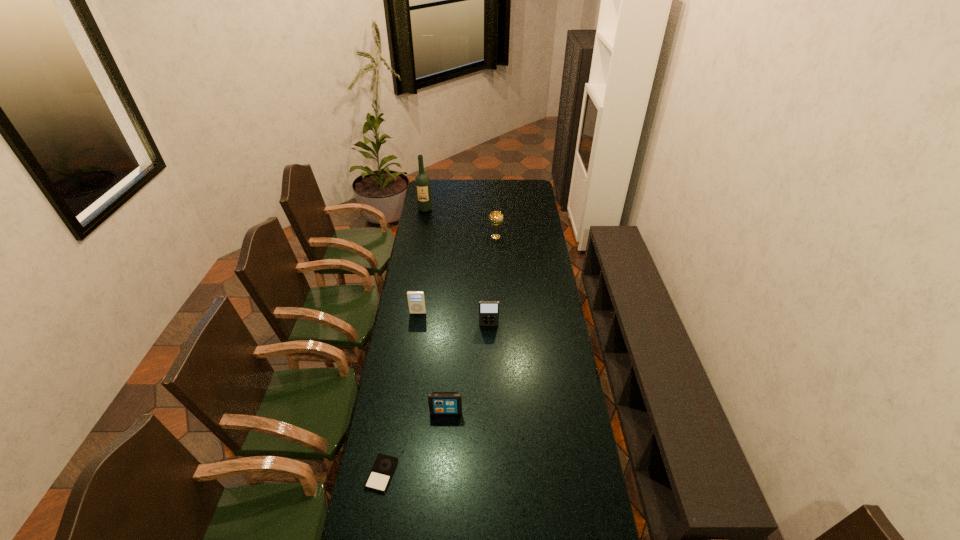
Image resolution: width=960 pixels, height=540 pixels. What are the coordinates of `vacant area between the second shortest iPod and the wine bottle` in the screenshot? It's located at (436, 310).

Where is `vacant area that lies between the rightmost iPod and the farthest object`? vacant area that lies between the rightmost iPod and the farthest object is located at coordinates (457, 267).

Locate an element on the screen. vacant point located between the rightmost iPod and the second iPod from right to left is located at coordinates (468, 368).

The width and height of the screenshot is (960, 540). I want to click on free space between the fourth farthest object and the farthest object, so click(457, 267).

In order to click on free area in between the wine bottle and the chalice in this screenshot , I will do `click(461, 223)`.

This screenshot has width=960, height=540. I want to click on free space between the third farthest object and the fifth nearest object, so click(457, 275).

Where is `free space between the rightmost iPod and the tallest object`? free space between the rightmost iPod and the tallest object is located at coordinates (457, 267).

Locate an element on the screen. empty space that is in between the chalice and the nearest iPod is located at coordinates (439, 355).

What are the coordinates of `free spot between the chalice and the third nearest object` in the screenshot? It's located at (492, 281).

Identify the location of object that is the second nearest to the third tallest iPod. (488, 310).